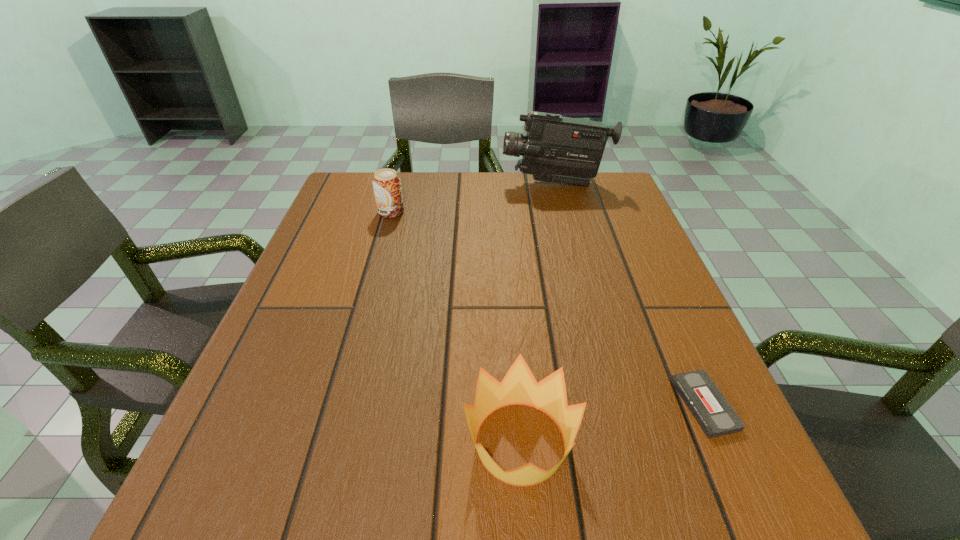
Where is `the tallest object`? The image size is (960, 540). the tallest object is located at coordinates (559, 149).

The width and height of the screenshot is (960, 540). In order to click on the farthest object in this screenshot , I will do `click(559, 149)`.

Locate an element on the screen. The width and height of the screenshot is (960, 540). the second farthest object is located at coordinates (386, 183).

At what (x,y) coordinates should I click in order to perform the action: click on beer can. Please return your answer as a coordinate pair (x, y). Looking at the image, I should click on (386, 183).

Locate an element on the screen. This screenshot has height=540, width=960. crown is located at coordinates (519, 386).

Where is `the shortest object`? Image resolution: width=960 pixels, height=540 pixels. the shortest object is located at coordinates [x=713, y=413].

The image size is (960, 540). I want to click on free region located 0.230m on the front-facing side of the farthest object, so click(x=420, y=183).

What are the coordinates of `vacant area located 0.060m on the front-facing side of the farthest object` in the screenshot? It's located at (480, 183).

Identify the location of free region located 0.270m on the front-facing side of the farthest object. (405, 183).

Identify the location of free space located 0.280m on the front of the leftmost object. (368, 297).